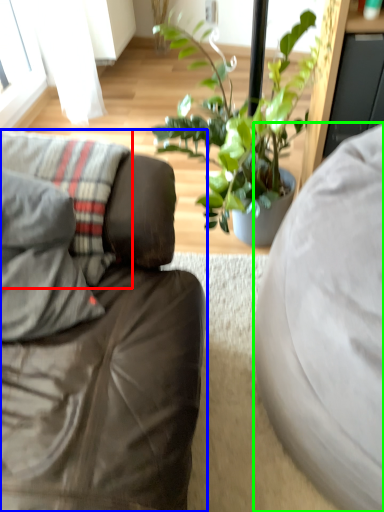
Question: Which object is the farthest from pillow (highlighted by a red box)? Choose among these: studio couch (highlighted by a blue box) or studio couch (highlighted by a green box).

Choices:
 (A) studio couch
 (B) studio couch

Answer: (B)